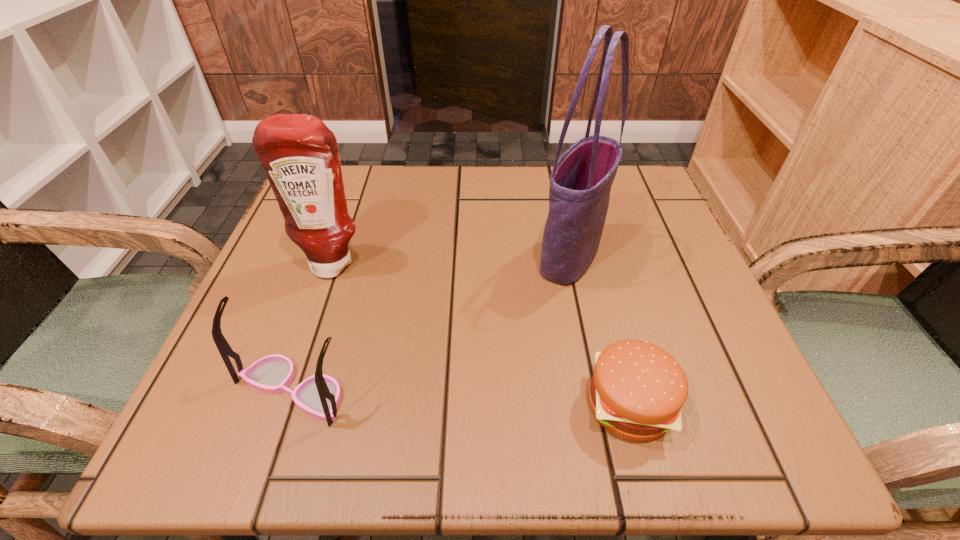
Image resolution: width=960 pixels, height=540 pixels. I want to click on unoccupied area between the condiment and the second shortest object, so click(313, 327).

This screenshot has height=540, width=960. Identify the location of free space between the hamburger and the condiment. (481, 334).

Identify the location of vacant region between the hamburger and the tote bag. (599, 330).

Locate an element on the screen. This screenshot has width=960, height=540. unoccupied area between the condiment and the spectacles is located at coordinates (313, 327).

You are a GUI agent. You are given a task and a screenshot of the screen. Output one action in this format:
    pyautogui.click(x=<x>, y=<y>)
    Task: Click on the vacant region between the third tallest object and the shortest object
    This screenshot has height=540, width=960.
    Given the screenshot: What is the action you would take?
    pyautogui.click(x=461, y=397)

You are a GUI agent. You are given a task and a screenshot of the screen. Output one action in this format:
    pyautogui.click(x=<x>, y=<y>)
    Task: Click on the unoccupied position between the third shortest object and the tallest object
    This screenshot has width=960, height=540.
    Given the screenshot: What is the action you would take?
    pyautogui.click(x=451, y=260)

The image size is (960, 540). I want to click on object that is the second nearest to the hamburger, so click(319, 395).

Select which object appears as the third closest to the second tallest object. Please provide its 2D coordinates. Your answer should be formatted as a tuple, i.e. [(x, y)], where the tuple contains the x and y coordinates of a point satisfying the conditions above.

[(637, 389)]

Locate an element on the screen. free location that satisfies the following two spatial constraints: 1. on the front side of the tote bag; 2. on the left side of the hamburger is located at coordinates (602, 404).

Locate an element on the screen. The image size is (960, 540). free space that satisfies the following two spatial constraints: 1. on the front side of the spectacles; 2. on the right side of the third shortest object is located at coordinates (290, 390).